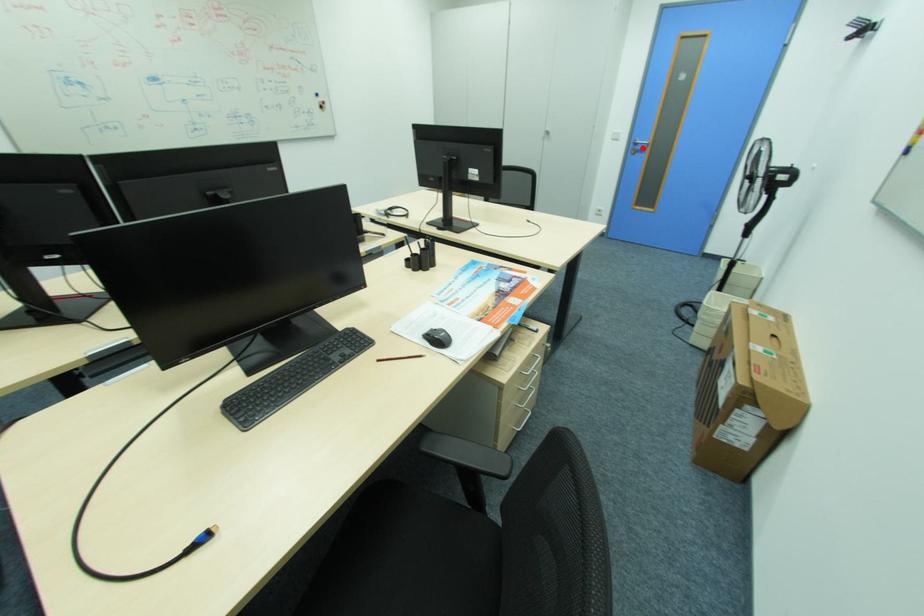
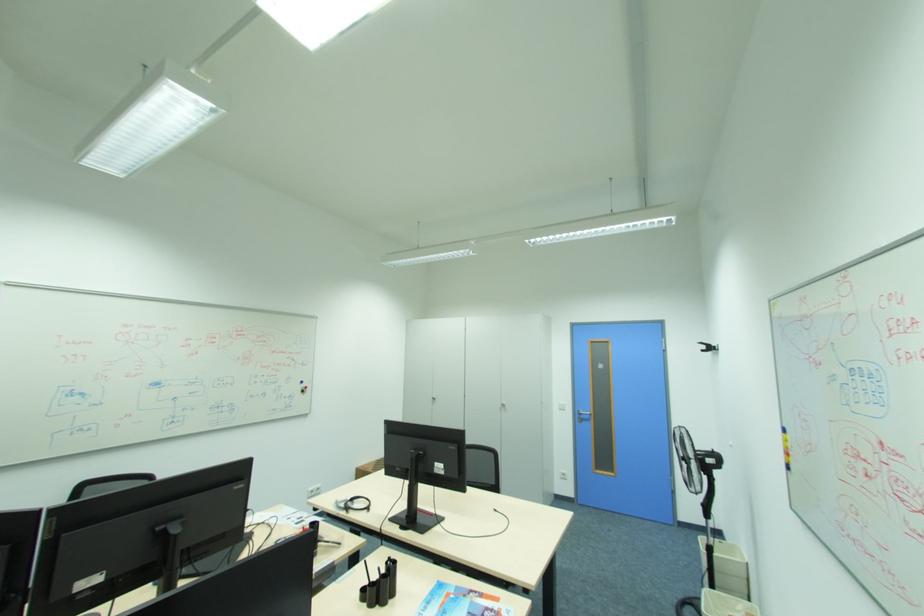
Locate, in the second image, the point that corresponds to the highlighted location in the first image.

(588, 416)